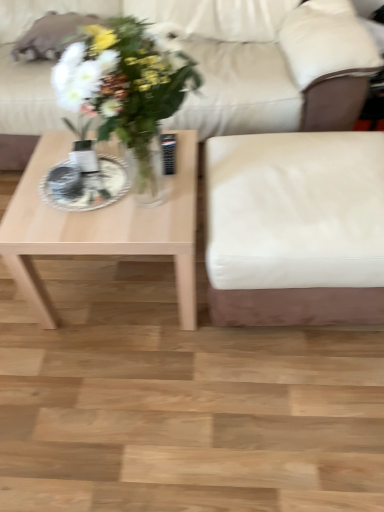
This screenshot has height=512, width=384. Describe the element at coordinates (102, 227) in the screenshot. I see `light wood coffee table at left` at that location.

Find the location of a particular element. Image resolution: width=384 pixels, height=512 pixels. white leather armchair at right is located at coordinates (295, 228).

Where is `armchair below the white glossy plate at center (from the image's perspective)`? armchair below the white glossy plate at center (from the image's perspective) is located at coordinates (295, 228).

In the scene shown: From a real-world perspective, relative to white leather armchair at right, is white glossy plate at center vertically above or below?

In terms of real-world spatial position, white glossy plate at center is above white leather armchair at right.

Consider the image. How different are the orientations of white glossy plate at center and white leather armchair at right in degrees?

4.53 degrees separate the facing orientations of white glossy plate at center and white leather armchair at right.

Is white glossy plate at center completely or partially outside of white leather armchair at right?

white glossy plate at center is positioned outside white leather armchair at right.

Is beige leather couch at center wider or thinner than white glossy plate at center?

Considering their sizes, beige leather couch at center looks broader than white glossy plate at center.

This screenshot has height=512, width=384. Find the location of `studio couch behind the white glossy plate at center`. studio couch behind the white glossy plate at center is located at coordinates (274, 87).

Is beige leather couch at center outside of white glossy plate at center?

Indeed, beige leather couch at center is completely outside white glossy plate at center.

Does beige leather couch at center have a larger size compared to white glossy plate at center?

Yes.

Is white glossy plate at center inside light wood coffee table at left?

Yes.

Locate an element on the screen. The height and width of the screenshot is (512, 384). coffee table below the white glossy plate at center (from a real-world perspective) is located at coordinates (102, 227).

Is light wood coffee table at left not near white glossy plate at center?

light wood coffee table at left is near white glossy plate at center, not far away.

From a real-world perspective, which object rests below the other?

From a 3D spatial view, light wood coffee table at left is below.

Does white glossy plate at center have a smaller size compared to beige leather couch at center?

Correct, white glossy plate at center occupies less space than beige leather couch at center.

From the image's perspective, which one is positioned lower, white glossy plate at center or beige leather couch at center?

white glossy plate at center appears lower in the image.

Considering the sizes of objects white glossy plate at center and beige leather couch at center in the image provided, who is taller, white glossy plate at center or beige leather couch at center?

Standing taller between the two is beige leather couch at center.

Is white glossy plate at center aimed at beige leather couch at center?

No, white glossy plate at center is not turned towards beige leather couch at center.

From a real-world perspective, is light wood coffee table at left positioned under beige leather couch at center based on gravity?

Correct, in the physical world, light wood coffee table at left is lower than beige leather couch at center.

From the image's perspective, is light wood coffee table at left positioned above or below beige leather couch at center?

Based on their image positions, light wood coffee table at left is located beneath beige leather couch at center.

Would you say beige leather couch at center is part of light wood coffee table at left's contents?

That's incorrect, beige leather couch at center is not inside light wood coffee table at left.

How far apart are light wood coffee table at left and beige leather couch at center?

They are 24.27 inches apart.

From a real-world perspective, relative to beige leather couch at center, is white leather armchair at right vertically above or below?

white leather armchair at right is below beige leather couch at center.

Is white leather armchair at right looking in the opposite direction of beige leather couch at center?

Yes, white leather armchair at right is positioned with its back facing beige leather couch at center.

Is white leather armchair at right directly adjacent to beige leather couch at center?

No, white leather armchair at right is not with beige leather couch at center.

Is light wood coffee table at left positioned with its back to white leather armchair at right?

No, light wood coffee table at left is not facing away from white leather armchair at right.

Is the depth of light wood coffee table at left greater than that of white leather armchair at right?

Yes.

Considering the relative sizes of light wood coffee table at left and white leather armchair at right in the image provided, is light wood coffee table at left taller than white leather armchair at right?

No.

The height and width of the screenshot is (512, 384). Identify the location of armchair that is on the right side of white glossy plate at center. (295, 228).

Where is `plate that is above the beige leather couch at center (from a real-world perspective)`? plate that is above the beige leather couch at center (from a real-world perspective) is located at coordinates (89, 186).

When comparing their distances from beige leather couch at center, does white glossy plate at center or light wood coffee table at left seem closer?

light wood coffee table at left is positioned closer to the anchor beige leather couch at center.

From the image, which object appears to be nearer to light wood coffee table at left, white leather armchair at right or beige leather couch at center?

Among the two, white leather armchair at right is located nearer to light wood coffee table at left.

Looking at the image, which one is located further to white glossy plate at center, beige leather couch at center or light wood coffee table at left?

Based on the image, beige leather couch at center appears to be further to white glossy plate at center.

When comparing their distances from white leather armchair at right, does beige leather couch at center or light wood coffee table at left seem further?

beige leather couch at center.

Based on their spatial positions, is light wood coffee table at left or beige leather couch at center closer to white glossy plate at center?

Among the two, light wood coffee table at left is located nearer to white glossy plate at center.

Which object lies further to the anchor point white glossy plate at center, beige leather couch at center or white leather armchair at right?

A: beige leather couch at center.

Which object lies nearer to the anchor point white leather armchair at right, light wood coffee table at left or white glossy plate at center?

light wood coffee table at left lies closer to white leather armchair at right than the other object.

Estimate the real-world distances between objects in this image. Which object is closer to light wood coffee table at left, beige leather couch at center or white leather armchair at right?

white leather armchair at right lies closer to light wood coffee table at left than the other object.

Find the location of a particular element. plate that lies between beige leather couch at center and light wood coffee table at left from top to bottom is located at coordinates (89, 186).

Locate an element on the screen. This screenshot has height=512, width=384. plate between beige leather couch at center and white leather armchair at right from top to bottom is located at coordinates (89, 186).

Locate an element on the screen. The image size is (384, 512). armchair between beige leather couch at center and light wood coffee table at left in the vertical direction is located at coordinates (295, 228).

Image resolution: width=384 pixels, height=512 pixels. Find the location of `coffee table between white glossy plate at center and white leather armchair at right from left to right`. coffee table between white glossy plate at center and white leather armchair at right from left to right is located at coordinates (102, 227).